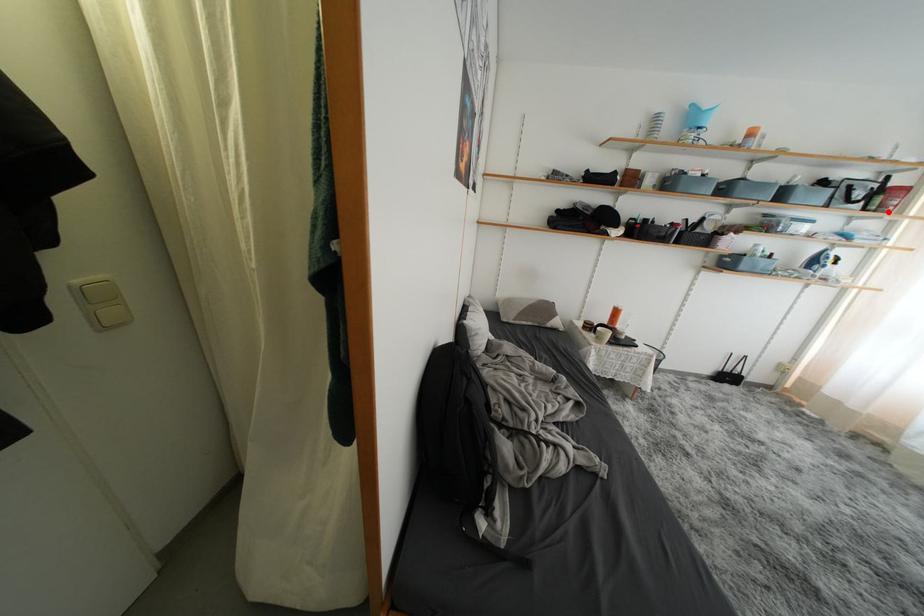
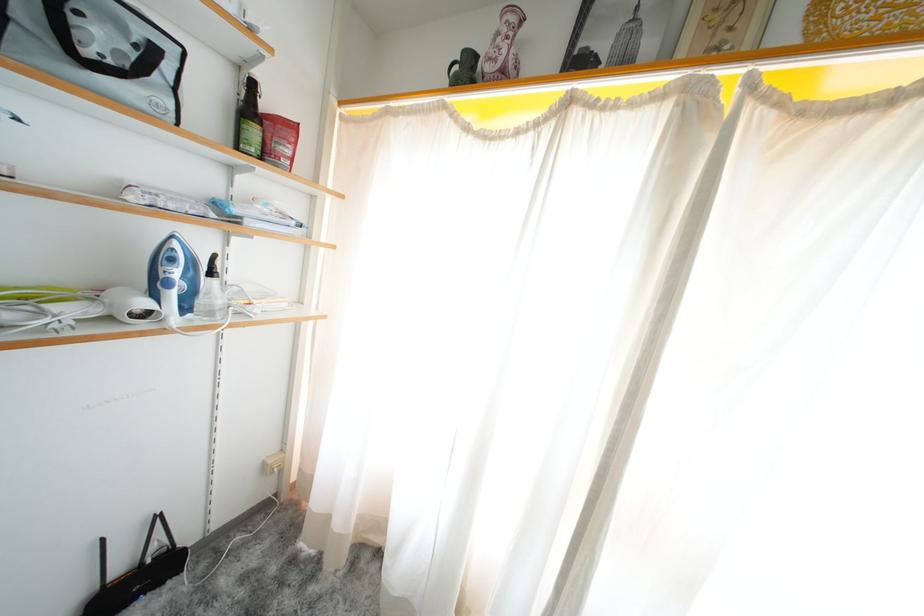
Question: I am providing you with two images of the same scene from different viewpoints. Image1 has a red point marked. In image2, the corresponding 3D location appears at what relative position? Reply with the corresponding letter.

Choices:
 (A) Closer
 (B) Farther

Answer: (A)